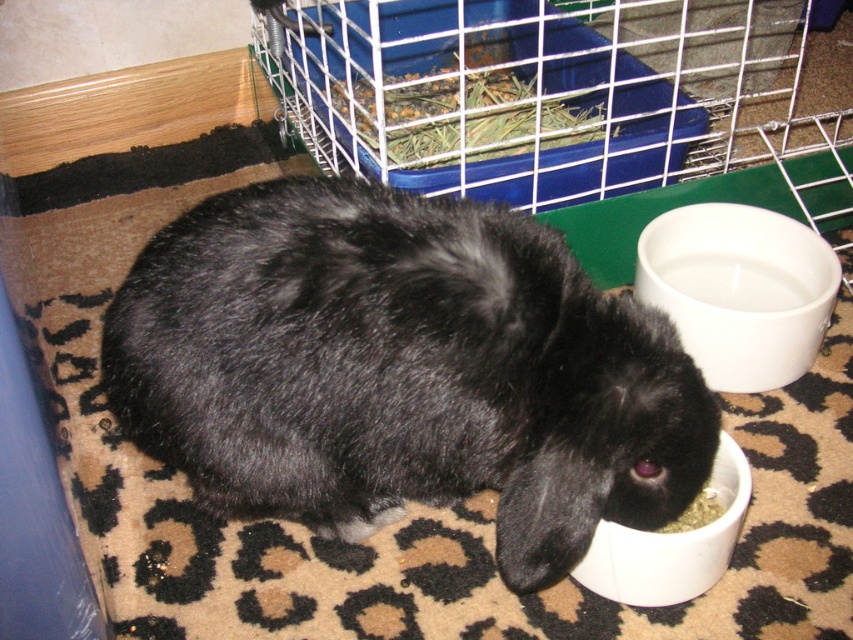
Question: Which point is closer to the camera?

Choices:
 (A) white glossy bowl at lower right
 (B) black fur rabbit at center
 (C) white glossy bowl at lower center

Answer: (B)

Question: From the image, what is the correct spatial relationship of white glossy bowl at lower right in relation to white glossy bowl at lower center?

Choices:
 (A) below
 (B) above

Answer: (B)

Question: Which of these objects is positioned closest to the black fur rabbit at center?

Choices:
 (A) white glossy bowl at lower right
 (B) white glossy bowl at lower center

Answer: (B)

Question: Can you confirm if black fur rabbit at center is positioned to the left of white glossy bowl at lower right?

Choices:
 (A) no
 (B) yes

Answer: (B)

Question: Does black fur rabbit at center appear under white glossy bowl at lower center?

Choices:
 (A) yes
 (B) no

Answer: (B)

Question: Estimate the real-world distances between objects in this image. Which object is farther from the white glossy bowl at lower center?

Choices:
 (A) black fur rabbit at center
 (B) white glossy bowl at lower right

Answer: (B)